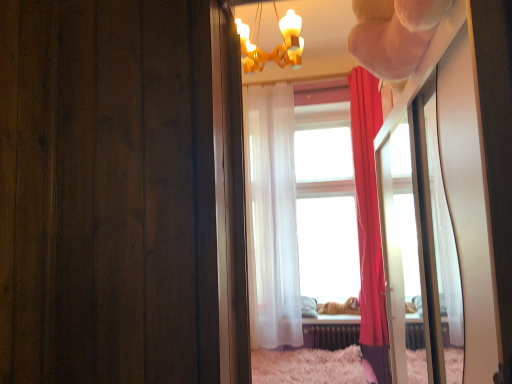
Question: From the image's perspective, would you say golden fur dog at center is shown under metallic radiator at lower center?

Choices:
 (A) no
 (B) yes

Answer: (A)

Question: Is golden fur dog at center placed right next to metallic radiator at lower center?

Choices:
 (A) no
 (B) yes

Answer: (A)

Question: Is golden fur dog at center facing away from metallic radiator at lower center?

Choices:
 (A) no
 (B) yes

Answer: (A)

Question: Is golden fur dog at center positioned in front of metallic radiator at lower center?

Choices:
 (A) no
 (B) yes

Answer: (A)

Question: Does golden fur dog at center have a greater width compared to metallic radiator at lower center?

Choices:
 (A) no
 (B) yes

Answer: (B)

Question: Choose the correct answer: Is white glossy mirror at upper right inside gold textured chandelier at upper center or outside it?

Choices:
 (A) inside
 (B) outside

Answer: (B)

Question: Does point (435, 167) appear closer or farther from the camera than point (296, 62)?

Choices:
 (A) farther
 (B) closer

Answer: (B)

Question: Considering the positions of white glossy mirror at upper right and gold textured chandelier at upper center in the image, is white glossy mirror at upper right wider or thinner than gold textured chandelier at upper center?

Choices:
 (A) wide
 (B) thin

Answer: (A)

Question: In the image, is white glossy mirror at upper right positioned in front of or behind gold textured chandelier at upper center?

Choices:
 (A) behind
 (B) front

Answer: (B)

Question: From their relative heights in the image, would you say translucent white curtain at center, the 2th curtain when ordered from right to left, is taller or shorter than silky red curtain at right, which is the second curtain from left to right?

Choices:
 (A) tall
 (B) short

Answer: (A)

Question: Is point (284, 342) positioned closer to the camera than point (374, 190)?

Choices:
 (A) closer
 (B) farther

Answer: (B)

Question: In the image, is translucent white curtain at center, the 2th curtain when ordered from right to left, positioned in front of or behind silky red curtain at right, which is the second curtain from left to right?

Choices:
 (A) front
 (B) behind

Answer: (B)

Question: Looking at their shapes, would you say translucent white curtain at center, the 2th curtain when ordered from right to left, is wider or thinner than silky red curtain at right, which is the first curtain from right to left?

Choices:
 (A) wide
 (B) thin

Answer: (A)

Question: In terms of width, does translucent white curtain at center, the 2th curtain when ordered from right to left, look wider or thinner when compared to gold textured chandelier at upper center?

Choices:
 (A) wide
 (B) thin

Answer: (B)

Question: Relative to gold textured chandelier at upper center, is translucent white curtain at center, acting as the first curtain starting from the left, in front or behind?

Choices:
 (A) behind
 (B) front

Answer: (A)